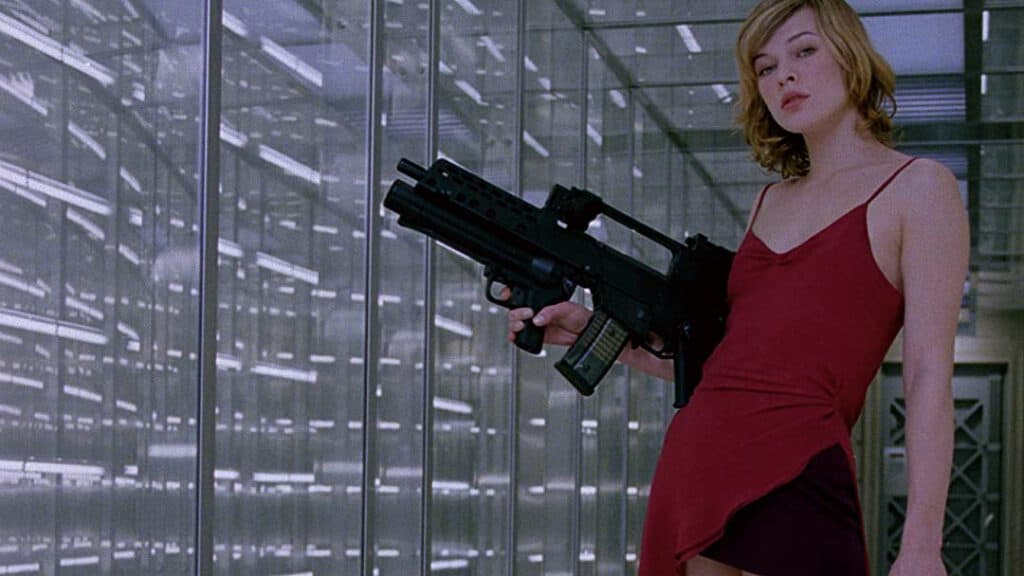
The width and height of the screenshot is (1024, 576). I want to click on wall, so click(424, 274).